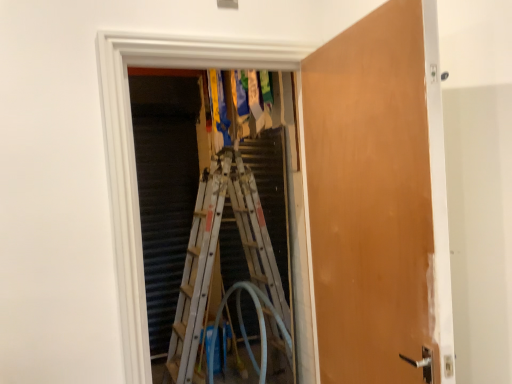
Question: Considering the positions of translucent rubber garden hose at center and wooden door at center in the image, is translucent rubber garden hose at center wider or thinner than wooden door at center?

Choices:
 (A) thin
 (B) wide

Answer: (B)

Question: Is translucent rubber garden hose at center inside or outside of wooden door at center?

Choices:
 (A) outside
 (B) inside

Answer: (A)

Question: Which object is positioned farthest from the translucent rubber garden hose at center?

Choices:
 (A) wooden door at center
 (B) white metallic ladder at center

Answer: (A)

Question: Which object is positioned closest to the wooden door at center?

Choices:
 (A) white metallic ladder at center
 (B) translucent rubber garden hose at center

Answer: (B)